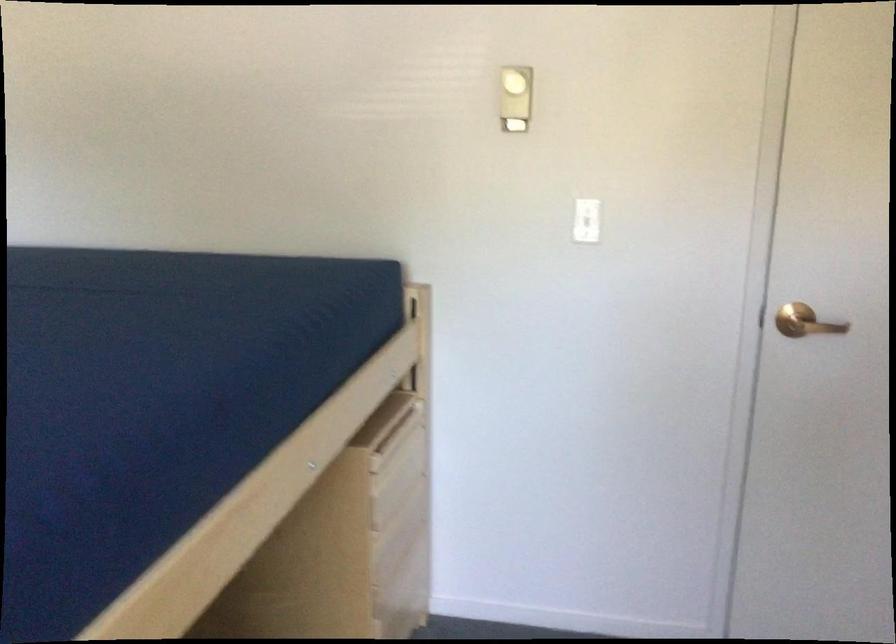
At what (x,y) coordinates should I click in order to perform the action: click on white light switch. Please return your answer as a coordinate pair (x, y). The width and height of the screenshot is (896, 644). Looking at the image, I should click on (586, 220).